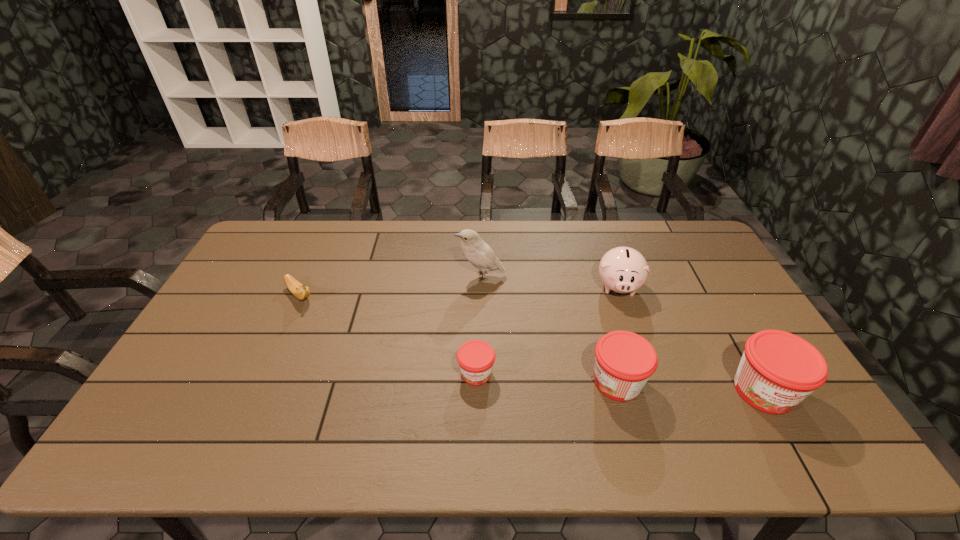
The width and height of the screenshot is (960, 540). What are the coordinates of `vacant space at the far left corner` in the screenshot? It's located at (295, 238).

You are a GUI agent. You are given a task and a screenshot of the screen. Output one action in this format:
    pyautogui.click(x=<x>, y=<y>)
    Task: Click on the vacant area at the near left corner
    This screenshot has height=540, width=960.
    Given the screenshot: What is the action you would take?
    pyautogui.click(x=198, y=414)

Locate an element on the screen. The height and width of the screenshot is (540, 960). free space at the far right corner is located at coordinates (704, 260).

Identify the location of free spot between the leftmost object and the bird. (390, 286).

The image size is (960, 540). Find the location of `empty location between the banana and the piggy bank`. empty location between the banana and the piggy bank is located at coordinates (459, 291).

At what (x,y) coordinates should I click in order to perform the action: click on vacant region between the piggy bank and the shortest jam. Please return your answer as a coordinate pair (x, y). This screenshot has height=540, width=960. Looking at the image, I should click on (547, 330).

The height and width of the screenshot is (540, 960). What are the coordinates of `free space between the leftmost jam and the bird` in the screenshot? It's located at (478, 325).

Where is `free space between the shortest jam and the piggy bank`? free space between the shortest jam and the piggy bank is located at coordinates (547, 330).

Where is `vacant area that lies between the second shortest jam and the leftmost jam`? The height and width of the screenshot is (540, 960). vacant area that lies between the second shortest jam and the leftmost jam is located at coordinates (547, 377).

The image size is (960, 540). I want to click on vacant area that lies between the leftmost object and the second jam from right to left, so click(459, 339).